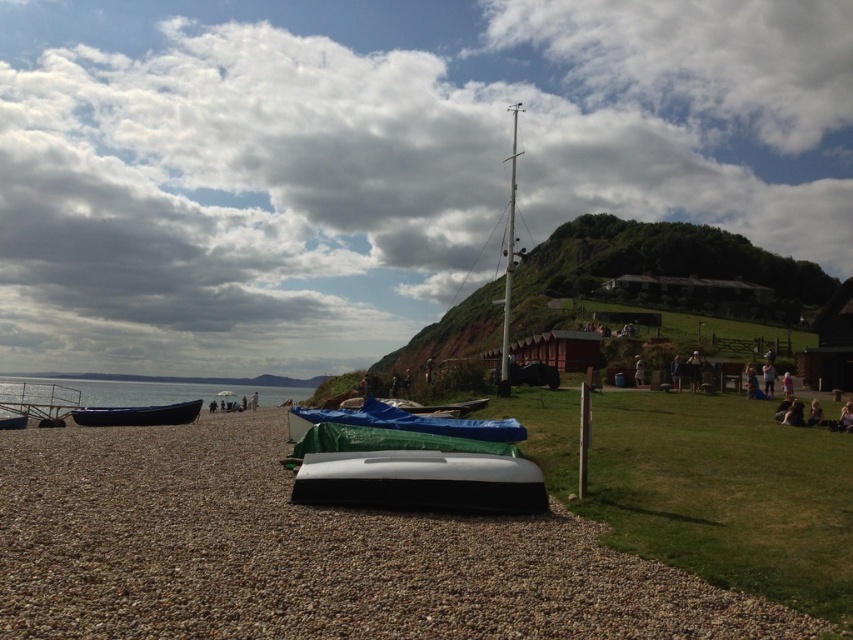
You are standing at the center of the pebble beach and want to walk towards the green grassy hillside at upper right. Which direction should you head?

You should head to the upper right direction to reach the green grassy hillside at upper right.

You are a person trying to place a small toy boat on the beach. You have two options from the image, the smooth gravel sand at center and the blue plastic boat at left. Which surface would allow the toy boat to float better?

The blue plastic boat at left would allow the toy boat to float better since the smooth gravel sand at center is thinner and may not provide a stable surface for floating.